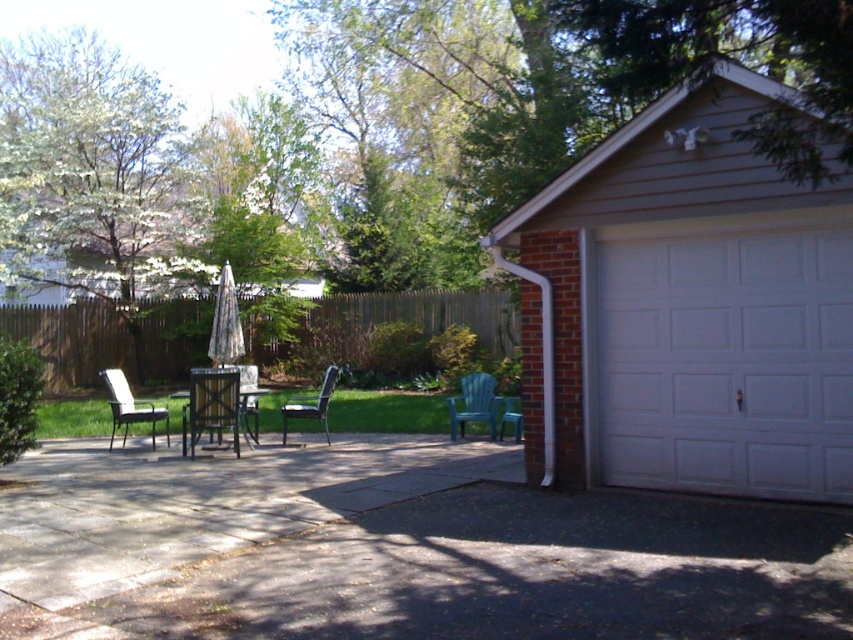
You are planning to set up a small garden in the backyard. You have two wooden chairs, the wooden chair at center and the wooden slatted chair at center. If you want to place a potted plant between them, which chair should be positioned to the right to create space?

The wooden slatted chair at center should be positioned to the right since the wooden chair at center is currently to the left of it, allowing space for the potted plant in between.

You are standing at the edge of the yard and want to place a 5 meter long garden hose from the teal plastic chair at lower right to the white textured garage door at right. Is the distance sufficient for the hose to reach without moving the chair?

The white textured garage door at right is 4.55 meters from the teal plastic chair at lower right. Since the hose is 5 meters long, which is longer than the distance between them, the hose will reach without needing to move the chair.

You are standing at the entrance of the garage and want to sit down at the wooden chair at center. Which direction should you walk to reach it?

The wooden chair at center is located at point coordinates, so you should walk towards the center of the patio to reach it.